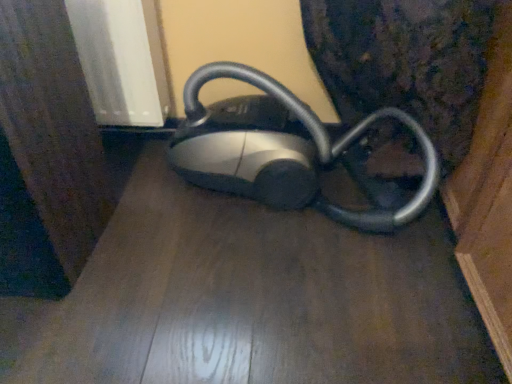
Find the location of a particular element. The height and width of the screenshot is (384, 512). free space in front of silver metallic vacuum cleaner at center is located at coordinates (288, 308).